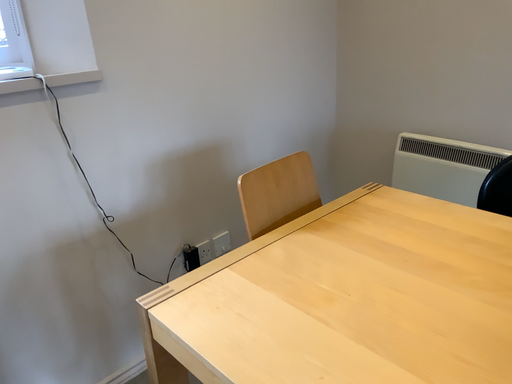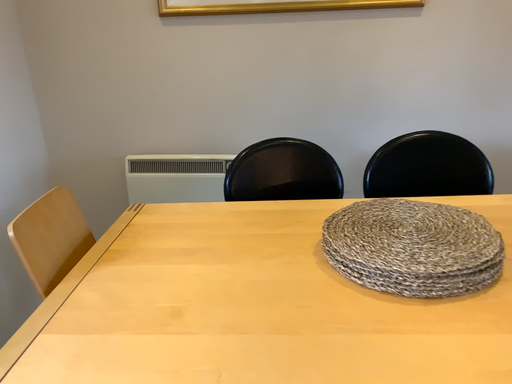
Question: Which way did the camera rotate in the video?

Choices:
 (A) rotated right
 (B) rotated left

Answer: (A)